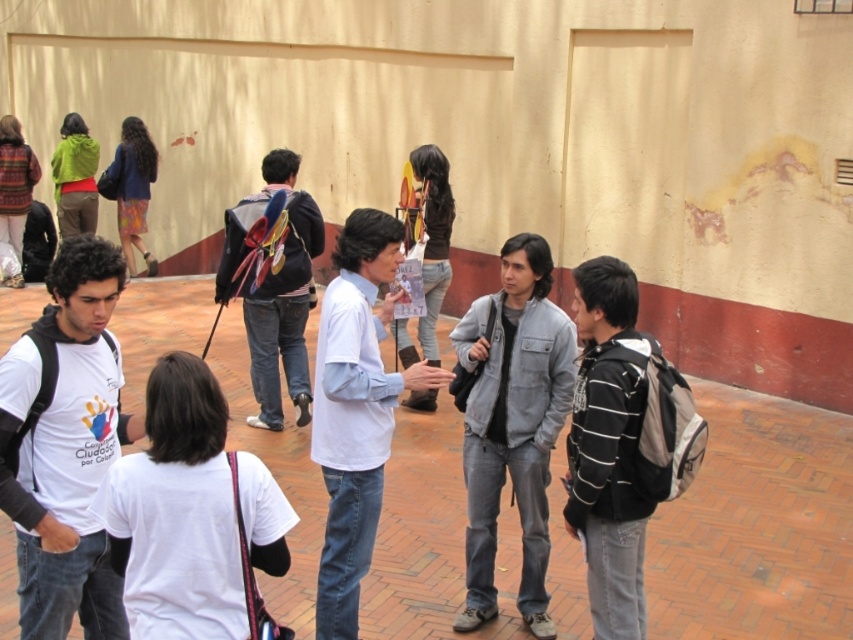
Question: Which of the following is the closest to the observer?

Choices:
 (A) gray denim jacket at center
 (B) white matte t-shirt at center
 (C) white cotton shirt at center

Answer: (B)

Question: Considering the real-world distances, which object is farthest from the gray denim jacket at center?

Choices:
 (A) white matte t-shirt at center
 (B) white cotton shirt at center

Answer: (A)

Question: Does gray denim jacket at center appear under white cotton shirt at center?

Choices:
 (A) yes
 (B) no

Answer: (A)

Question: Among these objects, which one is nearest to the camera?

Choices:
 (A) gray denim jacket at center
 (B) white matte t-shirt at center

Answer: (B)

Question: Can you confirm if white matte t-shirt at center is positioned to the left of white cotton shirt at center?

Choices:
 (A) no
 (B) yes

Answer: (B)

Question: Observing the image, what is the correct spatial positioning of white matte t-shirt at center in reference to gray denim jacket at center?

Choices:
 (A) left
 (B) right

Answer: (A)